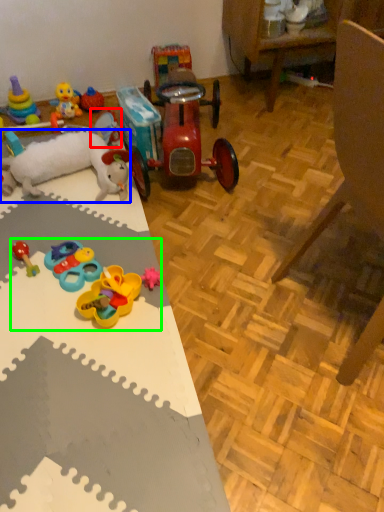
Question: Which is farther away from toy (highlighted by a red box)? toy (highlighted by a blue box) or toy (highlighted by a green box)?

Choices:
 (A) toy
 (B) toy

Answer: (B)